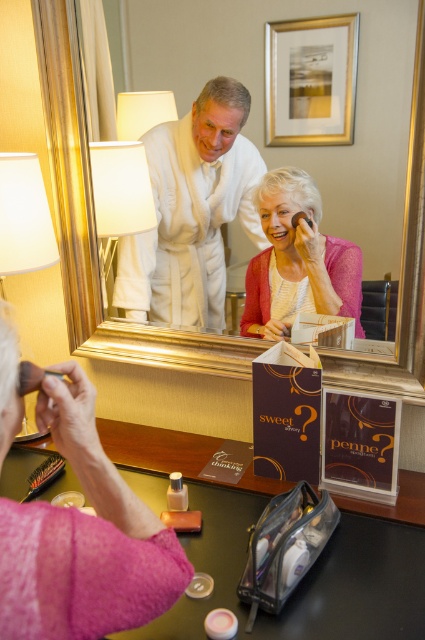
Question: Can you confirm if gold-framed mirror at upper center is positioned to the right of white fabric lampshade at upper left?

Choices:
 (A) yes
 (B) no

Answer: (A)

Question: Which object is positioned farthest from the white bathrobe at upper center?

Choices:
 (A) matte black brush at lower left
 (B) white fabric lampshade at left
 (C) pink matte sweater at center

Answer: (A)

Question: Can you confirm if white fabric lampshade at upper left is positioned to the left of matte black brush at lower left?

Choices:
 (A) yes
 (B) no

Answer: (B)

Question: Which of the following is the farthest from the observer?

Choices:
 (A) white bathrobe at upper center
 (B) matte white lampshade at upper left
 (C) white fabric lampshade at left

Answer: (B)

Question: From the image, what is the correct spatial relationship of pink fabric laugh at lower left in relation to white fabric lampshade at left?

Choices:
 (A) above
 (B) below

Answer: (B)

Question: Among these points, which one is farthest from the camera?

Choices:
 (A) (47, 253)
 (B) (73, 20)
 (C) (144, 241)
 (D) (334, 285)

Answer: (C)